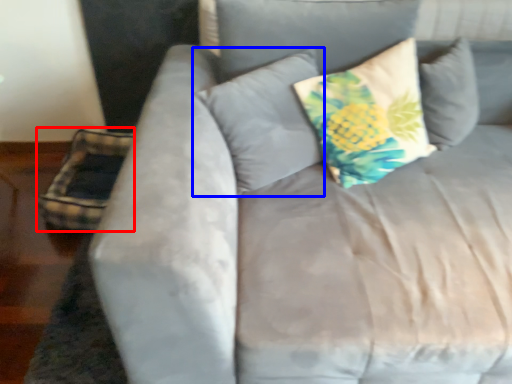
Question: Which of the following is the farthest to the observer, pillow (highlighted by a red box) or pillow (highlighted by a blue box)?

Choices:
 (A) pillow
 (B) pillow

Answer: (A)